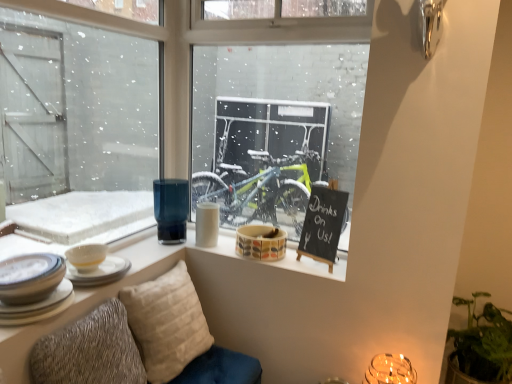
The height and width of the screenshot is (384, 512). What do you see at coordinates (167, 323) in the screenshot? I see `beige textured pillow at lower center, the second pillow when ordered from front to back` at bounding box center [167, 323].

Describe the element at coordinates (323, 224) in the screenshot. Image resolution: width=512 pixels, height=384 pixels. I see `black chalkboard at upper right` at that location.

Measure the distance between point (466,306) and camera.

Point (466,306) is 2.02 meters away from camera.

Find the location of a particular element. The image size is (512, 384). white ceramic plates at lower left, the 4th tableware viewed from the left is located at coordinates (38, 306).

Based on the photo, measure the distance between textured beige pillow at lower left, the 2th pillow positioned from the back, and camera.

A distance of 4.20 feet exists between textured beige pillow at lower left, the 2th pillow positioned from the back, and camera.

Where is `translucent glass candle holder at lower right`? translucent glass candle holder at lower right is located at coordinates (390, 370).

Identify the location of beige textured pillow at lower center, the second pillow when ordered from front to back. Image resolution: width=512 pixels, height=384 pixels. (167, 323).

Considering their positions, is beige textured pillow at lower center, the second pillow when ordered from front to back, located in front of or behind porcelain bowl at center?

Visually, beige textured pillow at lower center, the second pillow when ordered from front to back, is located in front of porcelain bowl at center.

From the image's perspective, is beige textured pillow at lower center, the second pillow when ordered from front to back, on porcelain bowl at center?

Incorrect, from the image's perspective, beige textured pillow at lower center, the second pillow when ordered from front to back, is lower than porcelain bowl at center.

Considering the positions of objects beige textured pillow at lower center, which ranks as the 1th pillow in back-to-front order, and porcelain bowl at center in the image provided, who is more to the right, beige textured pillow at lower center, which ranks as the 1th pillow in back-to-front order, or porcelain bowl at center?

porcelain bowl at center is more to the right.

Are beige textured pillow at lower center, the second pillow when ordered from front to back, and porcelain bowl at center making contact?

No, beige textured pillow at lower center, the second pillow when ordered from front to back, is not next to porcelain bowl at center.

Between beige textured pillow at lower center, which ranks as the 1th pillow in back-to-front order, and white matte cup at center, placed as the 6th tableware when sorted from left to right, which one is positioned in front?

Positioned in front is beige textured pillow at lower center, which ranks as the 1th pillow in back-to-front order.

Based on the photo, are beige textured pillow at lower center, the second pillow when ordered from front to back, and white matte cup at center, placed as the 6th tableware when sorted from left to right, beside each other?

No, beige textured pillow at lower center, the second pillow when ordered from front to back, is not next to white matte cup at center, placed as the 6th tableware when sorted from left to right.

Is beige textured pillow at lower center, which ranks as the 1th pillow in back-to-front order, aimed at white matte cup at center, the 2th tableware positioned from the right?

No.

Locate an element on the screen. tableware that is the 1st one when counting rightward from the beige textured pillow at lower center, which ranks as the 1th pillow in back-to-front order is located at coordinates tap(207, 224).

From the image's perspective, between white ceramic plates at lower left, which is the fourth tableware in right-to-left order, and white ceramic plates at lower left, placed as the 6th tableware when sorted from right to left, who is located below?

white ceramic plates at lower left, which is the fourth tableware in right-to-left order.

Image resolution: width=512 pixels, height=384 pixels. Identify the location of the 5th tableware below the white ceramic plates at lower left, placed as the 6th tableware when sorted from right to left (from a real-world perspective). (38, 306).

Is white ceramic plates at lower left, the 4th tableware viewed from the left, shorter than white ceramic plates at lower left, placed as the 6th tableware when sorted from right to left?

Indeed, white ceramic plates at lower left, the 4th tableware viewed from the left, has a lesser height compared to white ceramic plates at lower left, placed as the 6th tableware when sorted from right to left.

Is white ceramic plates at lower left, which is the fourth tableware in right-to-left order, positioned with its back to white ceramic plates at lower left, the 2th tableware from the left?

No, white ceramic plates at lower left, which is the fourth tableware in right-to-left order, is not facing the opposite direction of white ceramic plates at lower left, the 2th tableware from the left.

From a real-world perspective, count 1st tablewares upward from the multicolored ceramic mug at center, the 7th tableware in the left-to-right sequence, and point to it. Please provide its 2D coordinates.

[(86, 256)]

Is point (79, 251) positioned behind point (259, 251)?

No.

From the image's perspective, which is below, white ceramic bowl at left, acting as the third tableware starting from the left, or multicolored ceramic mug at center, the 1th tableware from the right?

white ceramic bowl at left, acting as the third tableware starting from the left, from the image's perspective.

Is white ceramic bowl at left, acting as the third tableware starting from the left, in front of or behind multicolored ceramic mug at center, the 7th tableware in the left-to-right sequence, in the image?

white ceramic bowl at left, acting as the third tableware starting from the left, is in front of multicolored ceramic mug at center, the 7th tableware in the left-to-right sequence.

Is white ceramic bowl at left, the first tableware from the left, far away from black chalkboard at upper right?

Indeed, white ceramic bowl at left, the first tableware from the left, is not near black chalkboard at upper right.

How far apart are white ceramic bowl at left, the first tableware from the left, and black chalkboard at upper right?

They are 1.03 meters apart.

Can you tell me how much white ceramic bowl at left, the first tableware from the left, and black chalkboard at upper right differ in facing direction?

The facing directions of white ceramic bowl at left, the first tableware from the left, and black chalkboard at upper right are 116 degrees apart.

Can we say white ceramic bowl at left, which appears as the 7th tableware when viewed from the right, lies outside black chalkboard at upper right?

Indeed, white ceramic bowl at left, which appears as the 7th tableware when viewed from the right, is completely outside black chalkboard at upper right.

Could you tell me if beige textured pillow at lower center, the second pillow when ordered from front to back, is facing white ceramic plates at lower left, placed as the 6th tableware when sorted from right to left?

No, beige textured pillow at lower center, the second pillow when ordered from front to back, is not turned towards white ceramic plates at lower left, placed as the 6th tableware when sorted from right to left.

Looking at this image, is white ceramic plates at lower left, the 2th tableware from the left, a part of beige textured pillow at lower center, which ranks as the 1th pillow in back-to-front order?

No, white ceramic plates at lower left, the 2th tableware from the left, is not a part of beige textured pillow at lower center, which ranks as the 1th pillow in back-to-front order.

Which object is further away from the camera taking this photo, beige textured pillow at lower center, the second pillow when ordered from front to back, or white ceramic plates at lower left, placed as the 6th tableware when sorted from right to left?

beige textured pillow at lower center, the second pillow when ordered from front to back, is further away from the camera.

Which object is closer to the camera, black chalkboard at upper right or beige textured pillow at lower center, which ranks as the 1th pillow in back-to-front order?

beige textured pillow at lower center, which ranks as the 1th pillow in back-to-front order.

From the image's perspective, which object appears higher, black chalkboard at upper right or beige textured pillow at lower center, the second pillow when ordered from front to back?

black chalkboard at upper right.

Is black chalkboard at upper right looking in the opposite direction of beige textured pillow at lower center, which ranks as the 1th pillow in back-to-front order?

No, beige textured pillow at lower center, which ranks as the 1th pillow in back-to-front order, is not at the back of black chalkboard at upper right.

How far apart are black chalkboard at upper right and beige textured pillow at lower center, the second pillow when ordered from front to back?

black chalkboard at upper right is 25.50 inches away from beige textured pillow at lower center, the second pillow when ordered from front to back.

Identify the location of the 1st pillow below when counting from the porcelain bowl at center (from the image's perspective). (167, 323).

At what (x,y) coordinates should I click in order to perform the action: click on tableware that is the 6th object located above the beige textured pillow at lower center, which ranks as the 1th pillow in back-to-front order (from the image's perspective). Please return your answer as a coordinate pair (x, y). Looking at the image, I should click on (207, 224).

Based on their spatial positions, is beige textured pillow at lower center, the second pillow when ordered from front to back, or white ceramic plates at lower left, the 4th tableware viewed from the left, closer to multicolored ceramic mug at center, the 7th tableware in the left-to-right sequence?

Based on the image, beige textured pillow at lower center, the second pillow when ordered from front to back, appears to be nearer to multicolored ceramic mug at center, the 7th tableware in the left-to-right sequence.

Looking at the image, which one is located closer to white ceramic plates at lower left, the 4th tableware viewed from the left, white ceramic bowl at left, acting as the third tableware starting from the left, or porcelain bowl at center?

Among the two, white ceramic bowl at left, acting as the third tableware starting from the left, is located nearer to white ceramic plates at lower left, the 4th tableware viewed from the left.

Estimate the real-world distances between objects in this image. Which object is further from blue glass tumbler at center, which is the third tableware in right-to-left order, black chalkboard at upper right or translucent glass candle holder at lower right?

translucent glass candle holder at lower right.

Based on their spatial positions, is white ceramic plates at lower left, which is the fourth tableware in right-to-left order, or transparent glass window at upper left closer to beige textured pillow at lower center, the second pillow when ordered from front to back?

white ceramic plates at lower left, which is the fourth tableware in right-to-left order, is closer to beige textured pillow at lower center, the second pillow when ordered from front to back.

When comparing their distances from blue glass tumbler at center, which is the third tableware in right-to-left order, does white matte cup at center, placed as the 6th tableware when sorted from left to right, or beige textured pillow at lower center, which ranks as the 1th pillow in back-to-front order, seem further?

Based on the image, beige textured pillow at lower center, which ranks as the 1th pillow in back-to-front order, appears to be further to blue glass tumbler at center, which is the third tableware in right-to-left order.

When comparing their distances from textured beige pillow at lower left, the first pillow in the front-to-back sequence, does white ceramic plates at lower left, the 2th tableware from the left, or black chalkboard at upper right seem further?

black chalkboard at upper right is positioned further to the anchor textured beige pillow at lower left, the first pillow in the front-to-back sequence.

Estimate the real-world distances between objects in this image. Which object is further from beige textured pillow at lower center, the second pillow when ordered from front to back, blue glass tumbler at center, which is the third tableware in right-to-left order, or textured beige pillow at lower left, the first pillow in the front-to-back sequence?

Among the two, blue glass tumbler at center, which is the third tableware in right-to-left order, is located further to beige textured pillow at lower center, the second pillow when ordered from front to back.

When comparing their distances from white matte cup at center, the 2th tableware positioned from the right, does white ceramic plates at lower left, which is the fourth tableware in right-to-left order, or porcelain bowl at center seem closer?

Among the two, porcelain bowl at center is located nearer to white matte cup at center, the 2th tableware positioned from the right.

Where is `window located between white ceramic bowl at left, which appears as the 7th tableware when viewed from the right, and green leafy plant at lower right in the left-right direction`? The width and height of the screenshot is (512, 384). window located between white ceramic bowl at left, which appears as the 7th tableware when viewed from the right, and green leafy plant at lower right in the left-right direction is located at coordinates (77, 128).

Where is `pillow situated between blue glass tumbler at center, which is the third tableware in right-to-left order, and green leafy plant at lower right from left to right`? This screenshot has width=512, height=384. pillow situated between blue glass tumbler at center, which is the third tableware in right-to-left order, and green leafy plant at lower right from left to right is located at coordinates click(167, 323).

What are the coordinates of `window sill between transparent glass window at upper left and multicolored ceramic mug at center, the 1th tableware from the right` in the screenshot? It's located at (309, 264).

Image resolution: width=512 pixels, height=384 pixels. I want to click on candle holder located between white ceramic bowl at left, the fifth tableware viewed from the right, and green leafy plant at lower right in the left-right direction, so click(x=390, y=370).